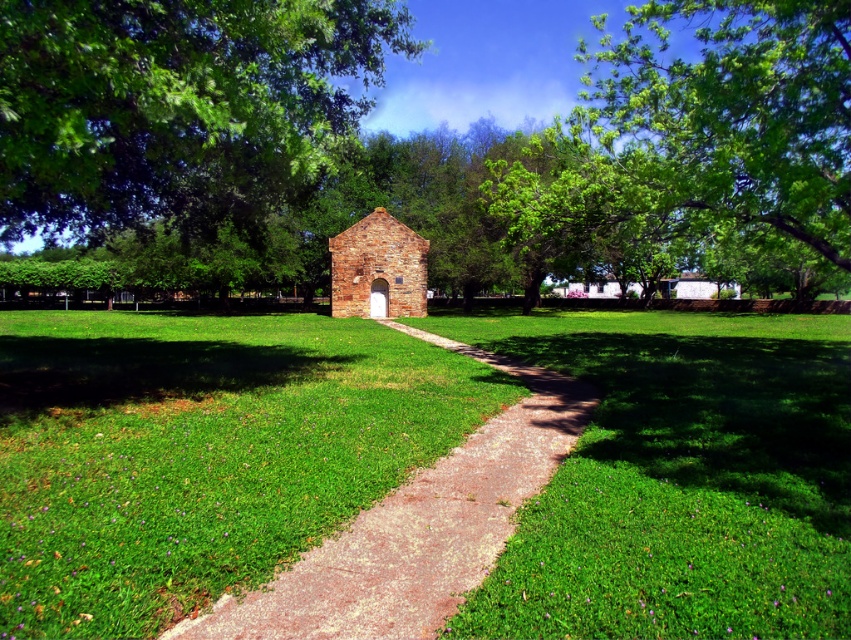
Measure the distance between point (33, 198) and camera.

10.17 meters

You are a GUI agent. You are given a task and a screenshot of the screen. Output one action in this format:
    pyautogui.click(x=<x>, y=<y>)
    Task: Click on the green leafy tree at upper center
    The width and height of the screenshot is (851, 640).
    Given the screenshot: What is the action you would take?
    pyautogui.click(x=174, y=99)

Can you confirm if green leafy tree at upper right is shorter than paved stone path at center?

No, green leafy tree at upper right is not shorter than paved stone path at center.

Which is behind, point (670, 189) or point (455, 518)?

The point (670, 189) is behind.

Which is behind, point (712, 35) or point (300, 628)?

The point (712, 35) is more distant.

Identify the location of green leafy tree at upper right. (701, 132).

How far apart are green leafy tree at upper center and green leafy tree at upper right?

green leafy tree at upper center is 34.37 meters from green leafy tree at upper right.

Is point (73, 193) positioned in front of point (627, 177)?

That is True.

Where is `green leafy tree at upper center`? green leafy tree at upper center is located at coordinates (174, 99).